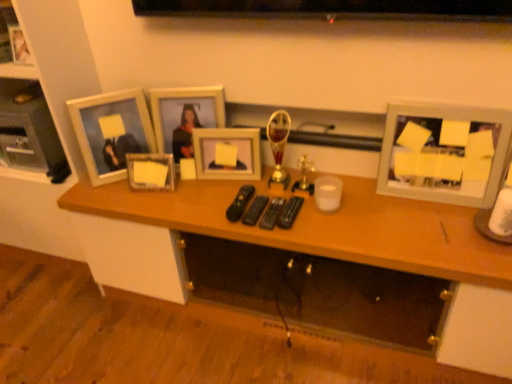
Image resolution: width=512 pixels, height=384 pixels. What are the coordinates of `free space to the left of matte glass picture frame at center, positioned as the second picture frame in right-to-left order` in the screenshot? It's located at (185, 190).